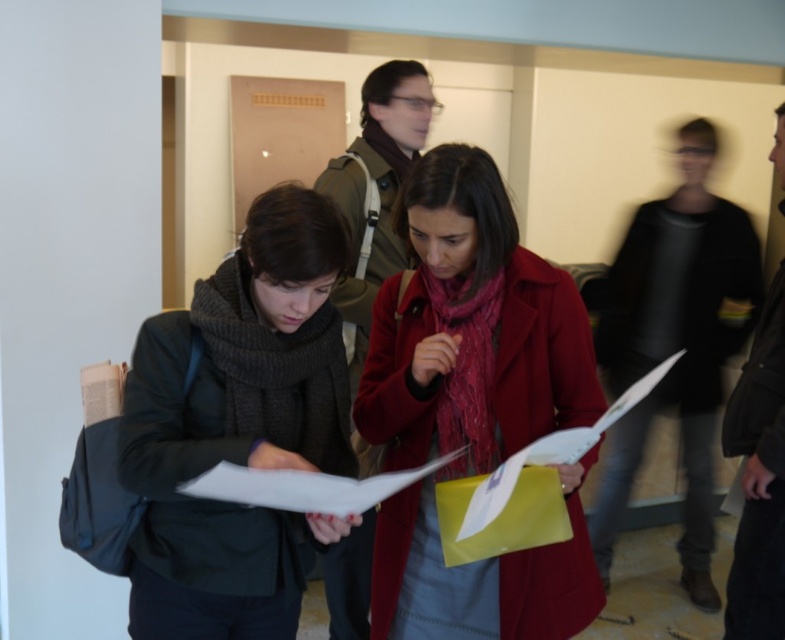
Consider the image. You are a delivery person trying to place a small package between the knitted wool scarf at left and the matte brown jacket at center. Can you fit it there?

The distance between the knitted wool scarf at left and the matte brown jacket at center is 32.12 inches. Since the package is small, it should fit comfortably within that space.

You are a tailor who needs to determine which item requires less fabric to alter between the knitted wool scarf at left and the matte brown jacket at center. Based on their sizes, which one would need less fabric?

The knitted wool scarf at left has a smaller size compared to the matte brown jacket at center, so it would require less fabric to alter.

You are standing in the hallway and see the matte red coat at center and the knitted wool scarf at left. Which item is positioned more to the right side?

The matte red coat at center is positioned to the right of the knitted wool scarf at left, so it is more to the right side.